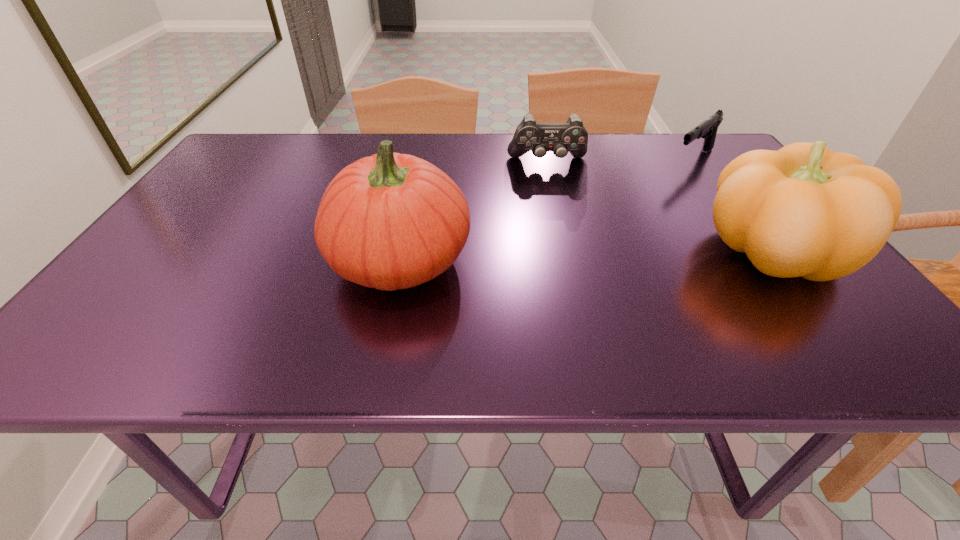
The image size is (960, 540). I want to click on vacant area at the far left corner, so click(x=289, y=138).

In the image, there is a desktop. In order to click on free space at the far right corner in this screenshot , I will do `click(728, 164)`.

This screenshot has height=540, width=960. I want to click on vacant area that lies between the gun and the second object from left to right, so click(x=621, y=161).

The width and height of the screenshot is (960, 540). I want to click on free space between the shortest object and the left pumpkin, so click(x=547, y=210).

This screenshot has width=960, height=540. I want to click on free space between the gun and the third object from right to left, so click(x=621, y=161).

Find the location of `vacant area that lies between the shortest object and the control`. vacant area that lies between the shortest object and the control is located at coordinates (621, 161).

The height and width of the screenshot is (540, 960). In order to click on free spot between the leftmost object and the right pumpkin in this screenshot , I will do `click(586, 255)`.

This screenshot has height=540, width=960. What are the coordinates of `empty location between the leftmost object and the control` in the screenshot? It's located at (474, 211).

Find the location of `free spot between the leftmost object and the right pumpkin`. free spot between the leftmost object and the right pumpkin is located at coordinates (586, 255).

You are a GUI agent. You are given a task and a screenshot of the screen. Output one action in this format:
    pyautogui.click(x=<x>, y=<y>)
    Task: Click on the free point between the third object from right to left and the shortest object
    The image size is (960, 540).
    Given the screenshot: What is the action you would take?
    pyautogui.click(x=621, y=161)